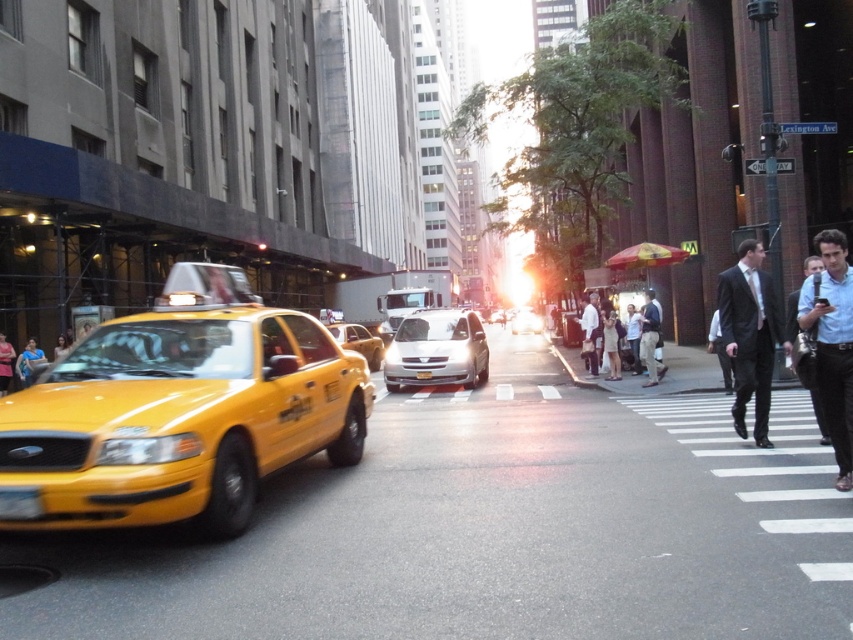
You are a pedestrian trying to cross the street. You see a silver metallic van at center and a white shirt at center. Which object is bigger and might be harder to avoid?

The silver metallic van at center is larger in size compared to the white shirt at center, so it might be harder to avoid.

You are a pedestrian standing at the point marked by the coordinates point (749, 336) in the image. Looking around, you see a yellow taxi cab on the left side. Which direction should you walk to reach the yellow taxi cab on the left side?

Since the yellow taxi cab on the left side is to your left, you should walk towards your left to reach it.

You are a delivery person who needs to carry a package that is 1.2 meters wide. You see the silver metallic van at center and the white shirt at center in the image. Which object can accommodate the package based on their widths?

The silver metallic van at center has a larger width than the white shirt at center, so the package can fit in the silver metallic van at center.